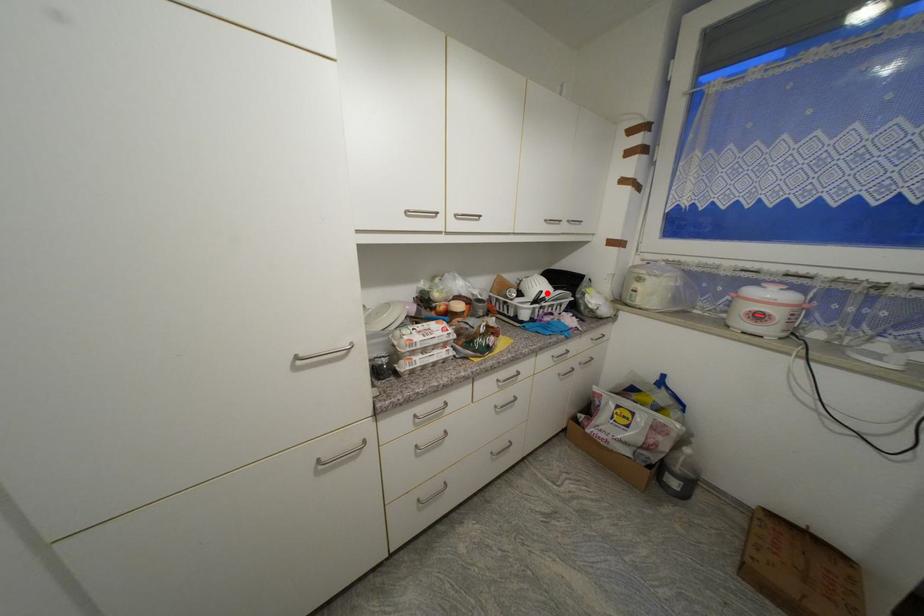
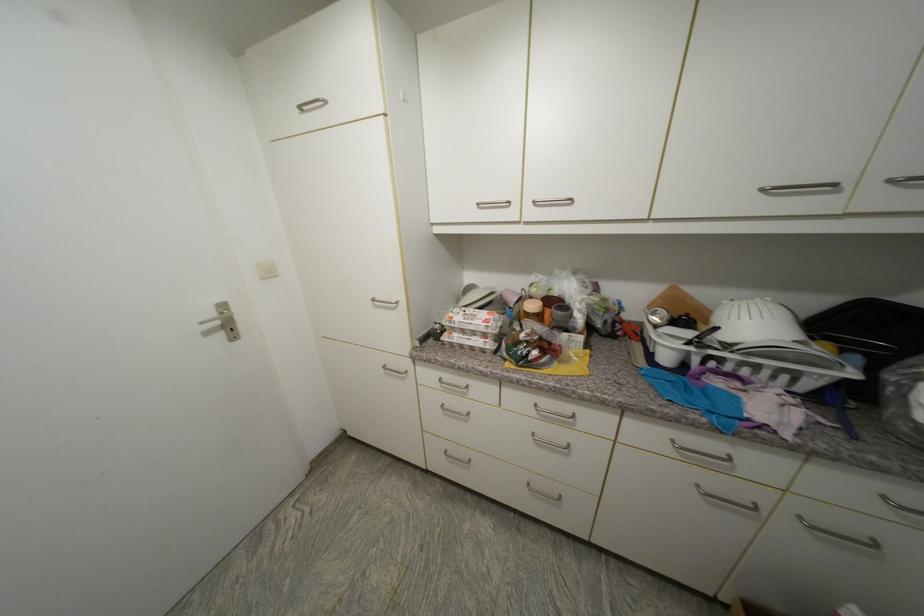
Question: I am providing you with two images of the same scene from different viewpoints. A red point is marked on the first image. Can you still see the location of the red point in image 2?

Choices:
 (A) Yes
 (B) No

Answer: (A)